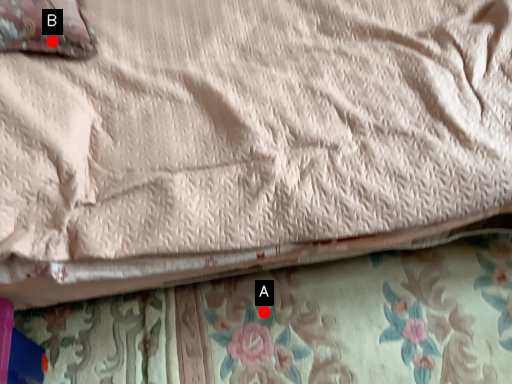
Question: Two points are circled on the image, labeled by A and B beside each circle. Which point appears farthest from the camera in this image?

Choices:
 (A) A is further
 (B) B is further

Answer: (A)